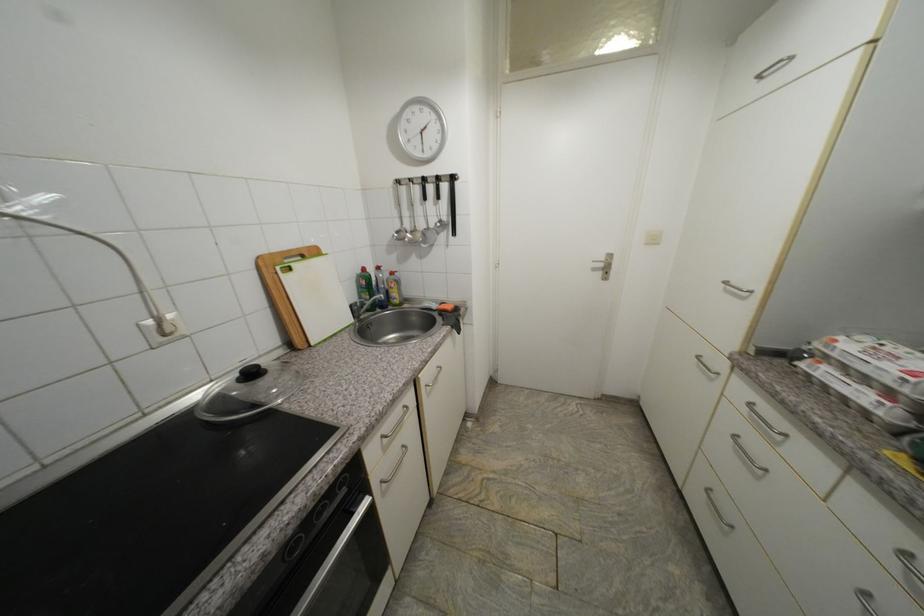
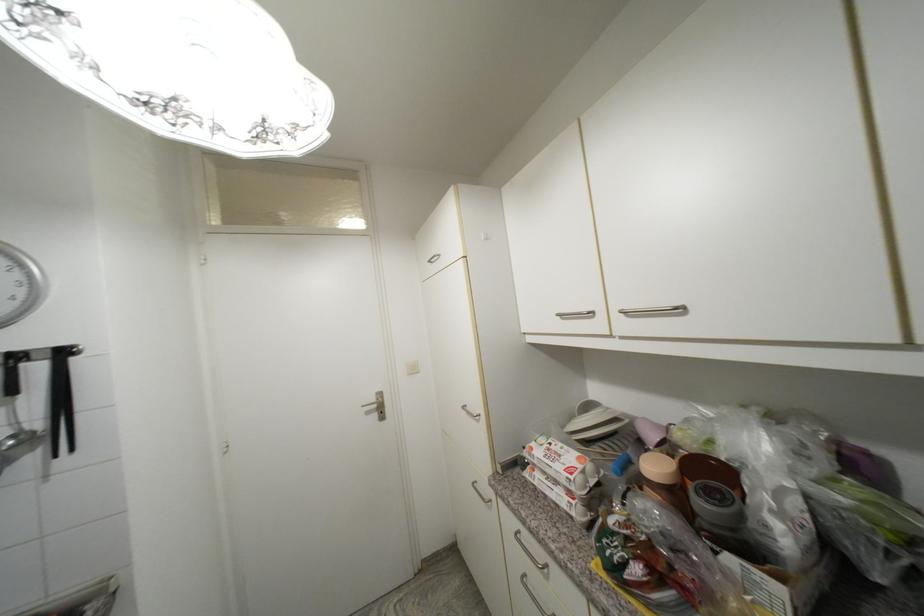
Where in the second image is the point corresponding to (x=842, y=342) from the first image?

(537, 451)